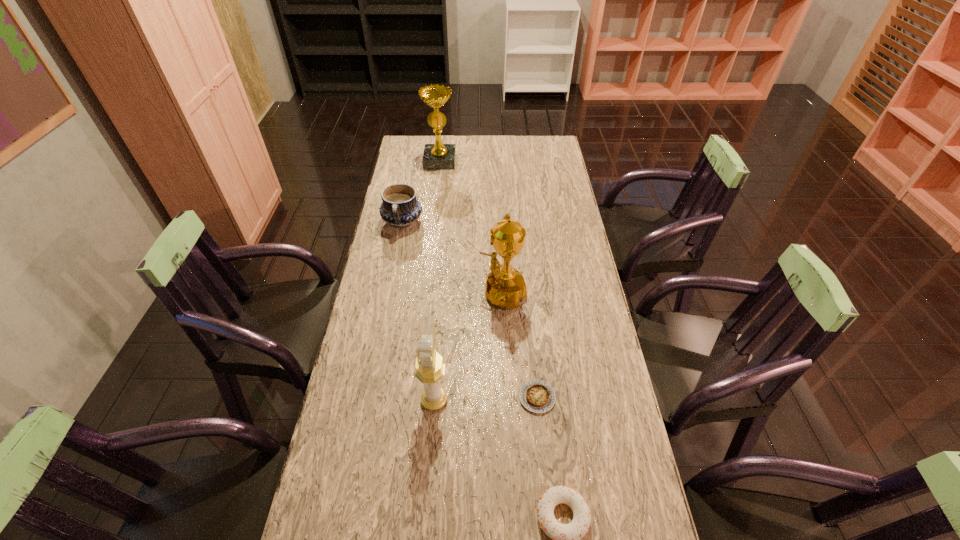
Identify the location of the farthest object. (436, 156).

The width and height of the screenshot is (960, 540). I want to click on the fourth nearest object, so click(505, 286).

You are a GUI agent. You are given a task and a screenshot of the screen. Output one action in this format:
    pyautogui.click(x=<x>, y=<y>)
    Task: Click on the rightmost award
    This screenshot has height=540, width=960.
    Given the screenshot: What is the action you would take?
    pyautogui.click(x=505, y=286)

At what (x,y) coordinates should I click in order to perform the action: click on the nearest award. Please return your answer as a coordinate pair (x, y). Looking at the image, I should click on (429, 369).

Locate an element on the screen. pottery is located at coordinates (400, 208).

Find the location of a particular element. The height and width of the screenshot is (540, 960). the fifth nearest object is located at coordinates (400, 208).

You are a GUI agent. You are given a task and a screenshot of the screen. Output one action in this format:
    pyautogui.click(x=<x>, y=<y>)
    Task: Click on the shortest object
    This screenshot has height=540, width=960.
    Given the screenshot: What is the action you would take?
    pyautogui.click(x=536, y=396)

I want to click on free location located 0.350m on the front-facing side of the farthest award, so click(433, 218).

This screenshot has width=960, height=540. I want to click on blank area located 0.070m on the front side of the rightmost award, so click(x=447, y=292).

Identify the location of free space located 0.270m on the front side of the rightmost award. The height and width of the screenshot is (540, 960). (388, 292).